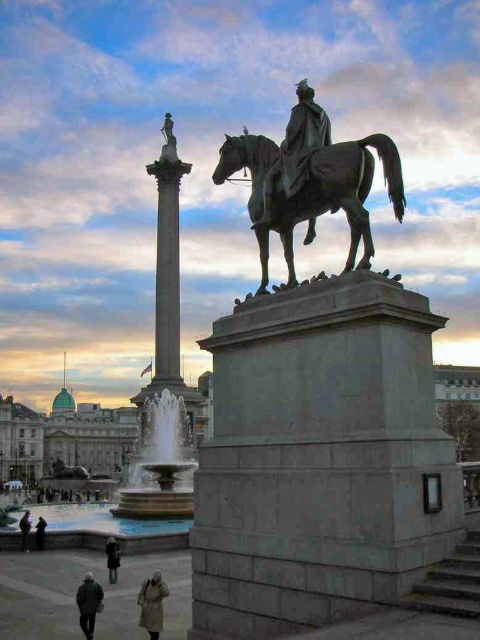
In the scene shown: You are standing in the public square looking at the equestrian statue and Nelson Column. There are two points marked on the statue base. Which point, point (x=322, y=598) or point (x=24, y=540), is closer to you?

Point (x=322, y=598) is closer to you than point (x=24, y=540).

You are a photographer standing in the public square. You want to take a photo of the equestrian statue with the Nelson Column in the background. You have two coats with you, the khaki wool coat at lower center and the dark gray jacket at lower left. Which coat should you choose to wear so that it doesn not distract from the statue and the Nelson Column in the background?

The khaki wool coat at lower center is smaller than the dark gray jacket at lower left. Therefore, wearing the khaki wool coat at lower center would be less likely to distract from the statue and Nelson Column in the background because it is smaller in size.